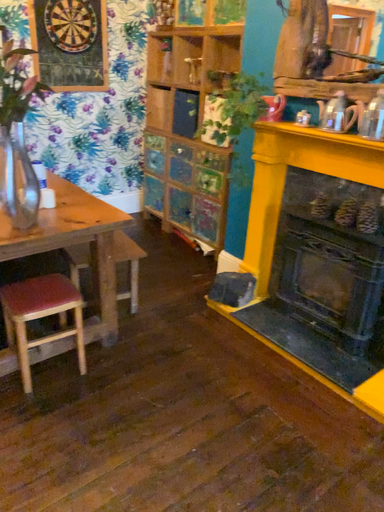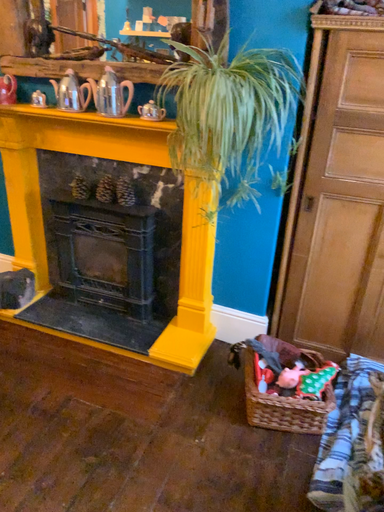
Question: Which way did the camera rotate in the video?

Choices:
 (A) rotated right
 (B) rotated left

Answer: (A)